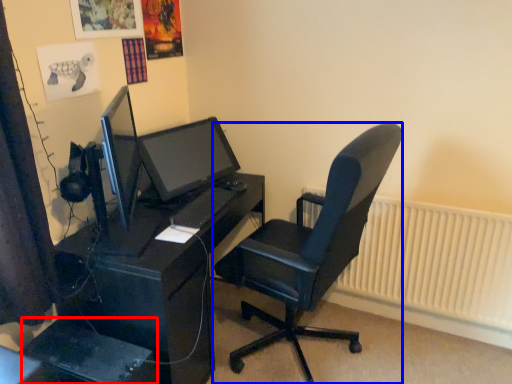
Question: Among these objects, which one is nearest to the camera, computer tower (highlighted by a red box) or chair (highlighted by a blue box)?

Choices:
 (A) computer tower
 (B) chair

Answer: (B)